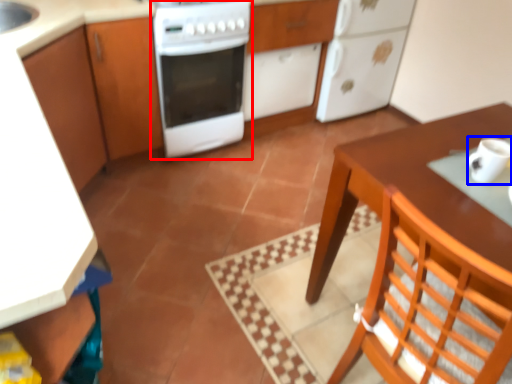
Question: Which point is closer to the camera, home appliance (highlighted by a red box) or mug (highlighted by a blue box)?

Choices:
 (A) home appliance
 (B) mug

Answer: (B)